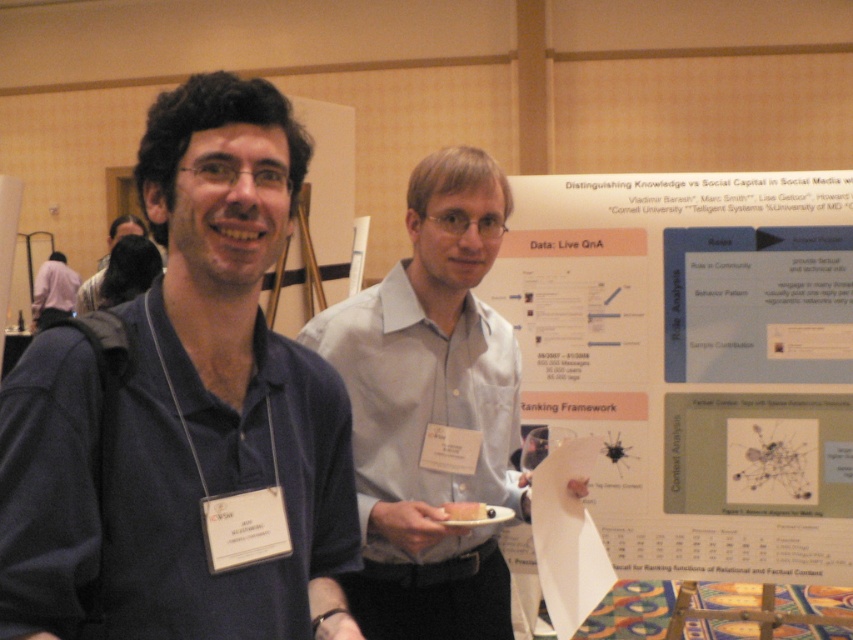
From the picture: Who is more forward, (x=251, y=458) or (x=462, y=611)?

Point (x=251, y=458)

Which is above, matte blue shirt at center or white shirt at center?

Positioned higher is matte blue shirt at center.

Who is more forward, (141, 408) or (440, 262)?

Point (141, 408) is in front.

Identify the location of matte blue shirt at center. The width and height of the screenshot is (853, 640). (184, 417).

Is white shirt at center closer to the viewer compared to matte black shirt at left?

Yes, it is in front of matte black shirt at left.

Does point (409, 355) come in front of point (115, 243)?

Yes.

Identify the location of white shirt at center. The image size is (853, 640). (432, 412).

Does matte blue shirt at center have a greater height compared to matte black shirt at left?

Indeed, matte blue shirt at center has a greater height compared to matte black shirt at left.

Find the location of a particular element. Image resolution: width=853 pixels, height=640 pixels. matte blue shirt at center is located at coordinates (184, 417).